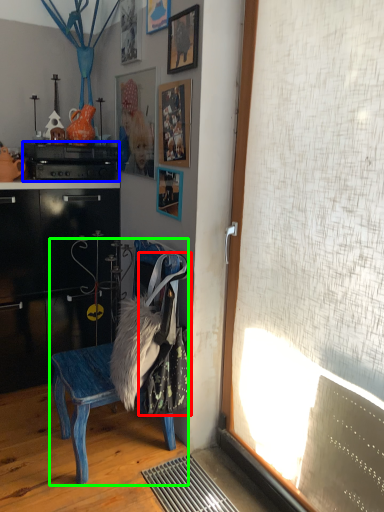
Question: Which object is positioned closest to laundry (highlighted by a red box)? Select from appliance (highlighted by a blue box) and chair (highlighted by a green box).

Choices:
 (A) appliance
 (B) chair

Answer: (B)